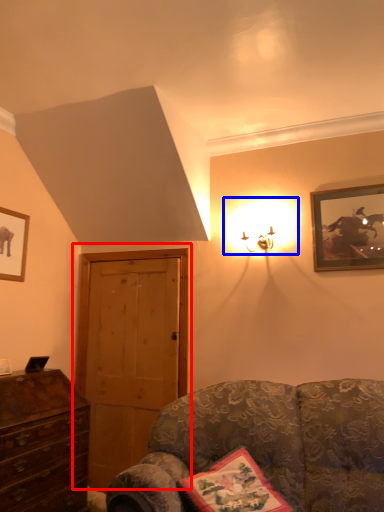
Question: Which of the following is the farthest to the observer, door (highlighted by a red box) or light (highlighted by a blue box)?

Choices:
 (A) door
 (B) light

Answer: (A)